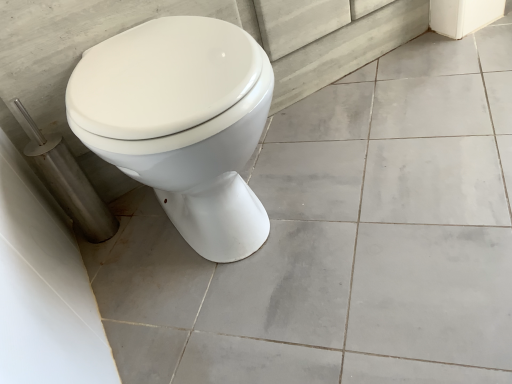
You are a GUI agent. You are given a task and a screenshot of the screen. Output one action in this format:
    pyautogui.click(x=<x>, y=<y>)
    Task: Click on the white glossy toilet at center
    
    Given the screenshot: What is the action you would take?
    pyautogui.click(x=181, y=123)

This screenshot has height=384, width=512. Describe the element at coordinates (181, 123) in the screenshot. I see `white glossy toilet at center` at that location.

Image resolution: width=512 pixels, height=384 pixels. Identify the location of white glossy toilet at center. (181, 123).